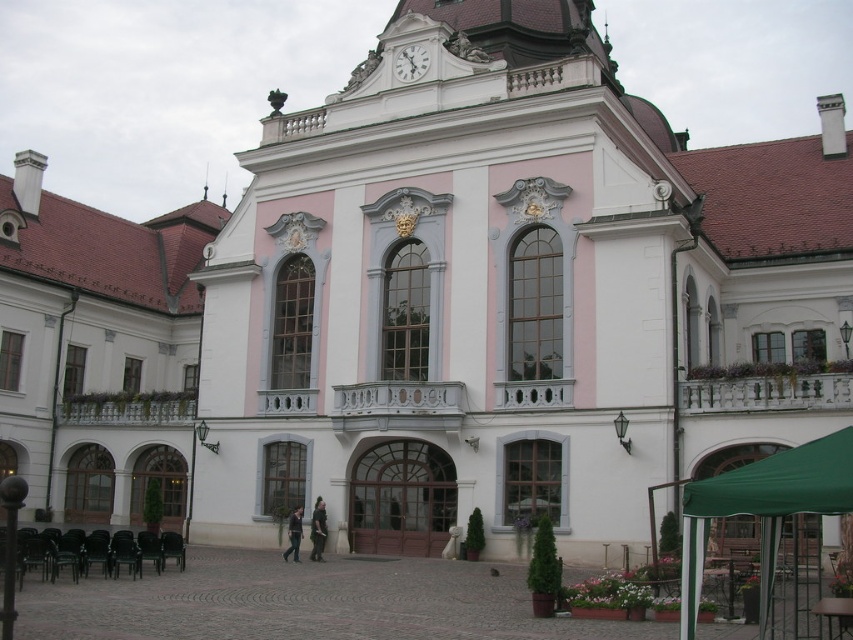
Is green fabric canopy at lower right shorter than white glossy clock at upper center?

No.

Is green fabric canopy at lower right smaller than white glossy clock at upper center?

No.

Is point (683, 566) more distant than point (399, 81)?

No, (683, 566) is in front of (399, 81).

Where is `green fabric canopy at lower right`? green fabric canopy at lower right is located at coordinates (763, 508).